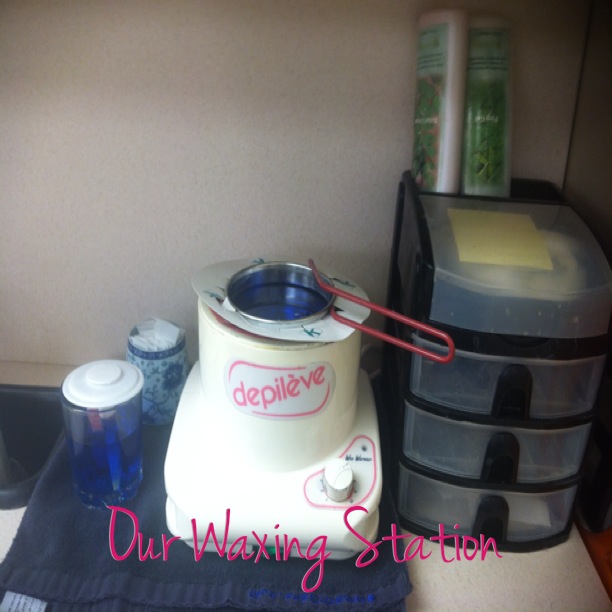
Where is `towel`? towel is located at coordinates (92, 573).